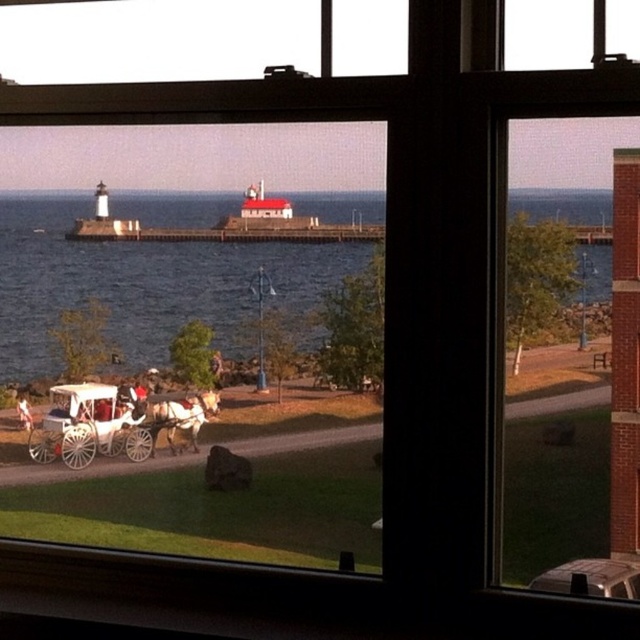
Question: Can you confirm if shiny brown horse at center is smaller than white fabric horse at lower left?

Choices:
 (A) no
 (B) yes

Answer: (A)

Question: Among these objects, which one is nearest to the camera?

Choices:
 (A) white fabric horse at lower left
 (B) shiny brown horse at center

Answer: (A)

Question: Can you confirm if blue water at center is smaller than shiny brown horse at center?

Choices:
 (A) no
 (B) yes

Answer: (A)

Question: Which point is closer to the camera taking this photo?

Choices:
 (A) (224, 200)
 (B) (172, 417)

Answer: (A)

Question: Which object appears closest to the camera in this image?

Choices:
 (A) white fabric horse at lower left
 (B) blue water at center

Answer: (B)

Question: Does shiny brown horse at center appear on the right side of white fabric horse at lower left?

Choices:
 (A) no
 (B) yes

Answer: (B)